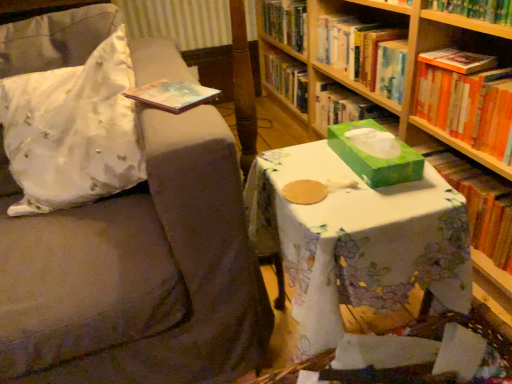
Where is `vacant area that is in front of green paper tissue box at center`? The height and width of the screenshot is (384, 512). vacant area that is in front of green paper tissue box at center is located at coordinates (381, 205).